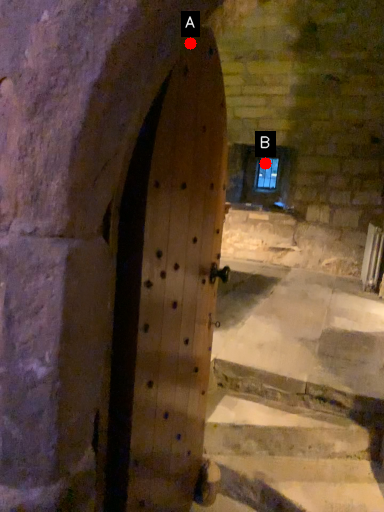
Question: Two points are circled on the image, labeled by A and B beside each circle. Which point is farther to the camera?

Choices:
 (A) A is further
 (B) B is further

Answer: (B)